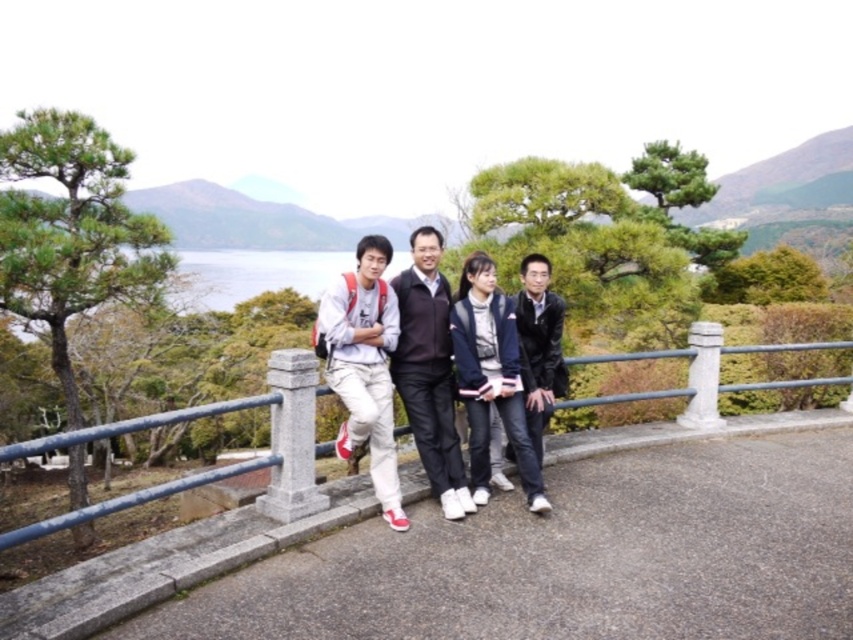
Between transparent water at center and black leather jacket at right, which one is positioned higher?

transparent water at center

Looking at this image, between transparent water at center and black leather jacket at right, which one appears on the left side from the viewer's perspective?

transparent water at center

What are the coordinates of `transparent water at center` in the screenshot? It's located at (254, 275).

Is light gray cotton pants at center wider than dark brown leather jacket at center?

No.

Is light gray cotton pants at center thinner than dark brown leather jacket at center?

Correct, light gray cotton pants at center's width is less than dark brown leather jacket at center's.

Identify the location of light gray cotton pants at center. The image size is (853, 640). (364, 365).

The image size is (853, 640). I want to click on light gray cotton pants at center, so click(x=364, y=365).

Is dark brown leather jacket at center taller than black leather jacket at right?

In fact, dark brown leather jacket at center may be shorter than black leather jacket at right.

Is the position of dark brown leather jacket at center more distant than that of black leather jacket at right?

That is False.

Where is `dark brown leather jacket at center`? dark brown leather jacket at center is located at coordinates (428, 371).